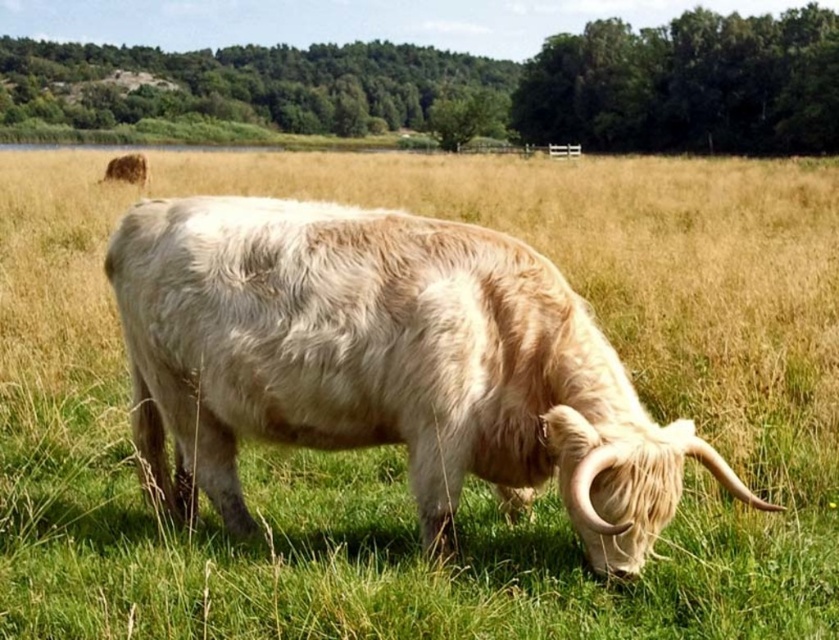
Question: Which point is farther to the camera?

Choices:
 (A) white woolly bull at center
 (B) fuzzy brown yak at upper left

Answer: (B)

Question: Does white woolly bull at center have a lesser width compared to fuzzy brown yak at upper left?

Choices:
 (A) no
 (B) yes

Answer: (A)

Question: Is white woolly bull at center wider than fuzzy brown yak at upper left?

Choices:
 (A) no
 (B) yes

Answer: (B)

Question: Is white woolly bull at center to the right of fuzzy brown yak at upper left from the viewer's perspective?

Choices:
 (A) yes
 (B) no

Answer: (A)